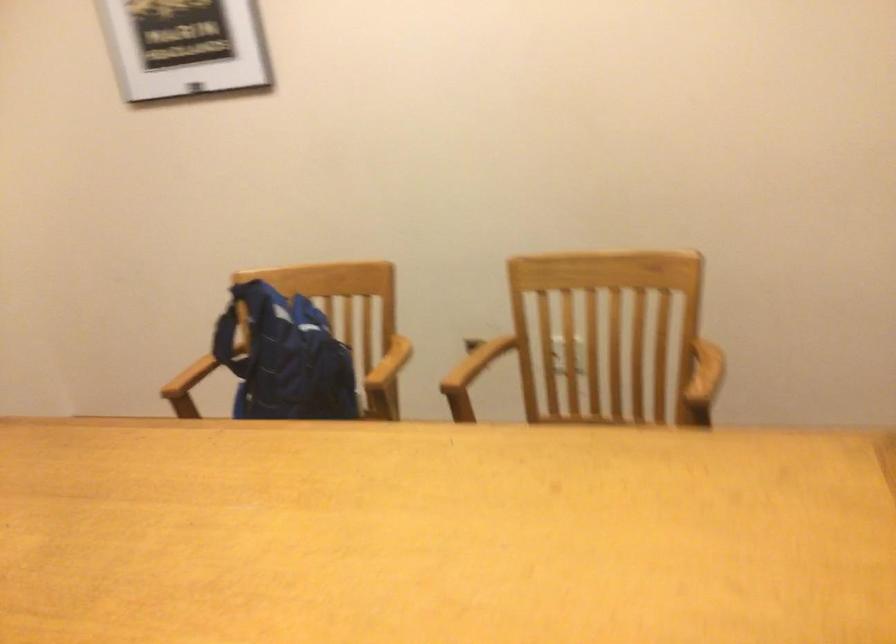
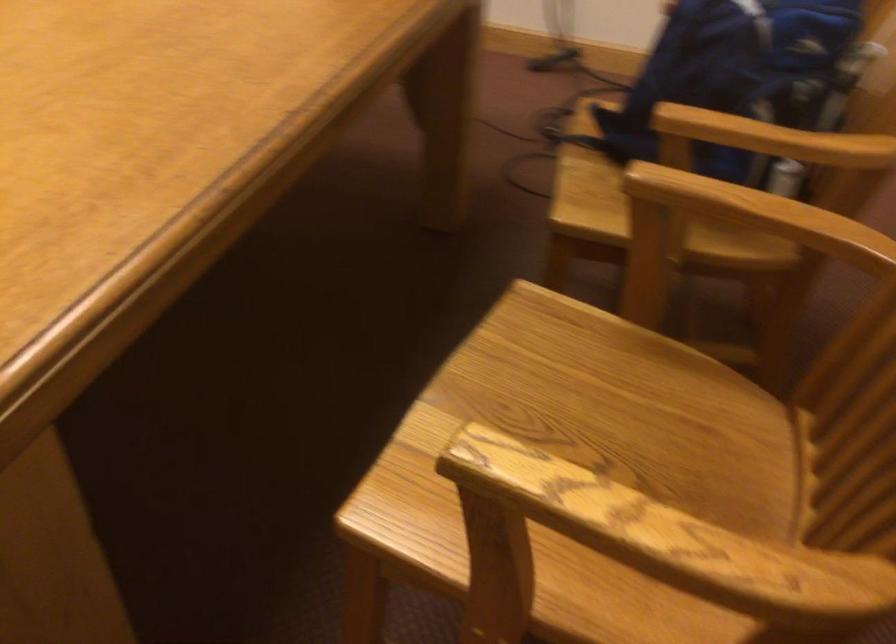
Locate, in the second image, the point that corresponds to pixel 709 368 in the first image.

(658, 542)